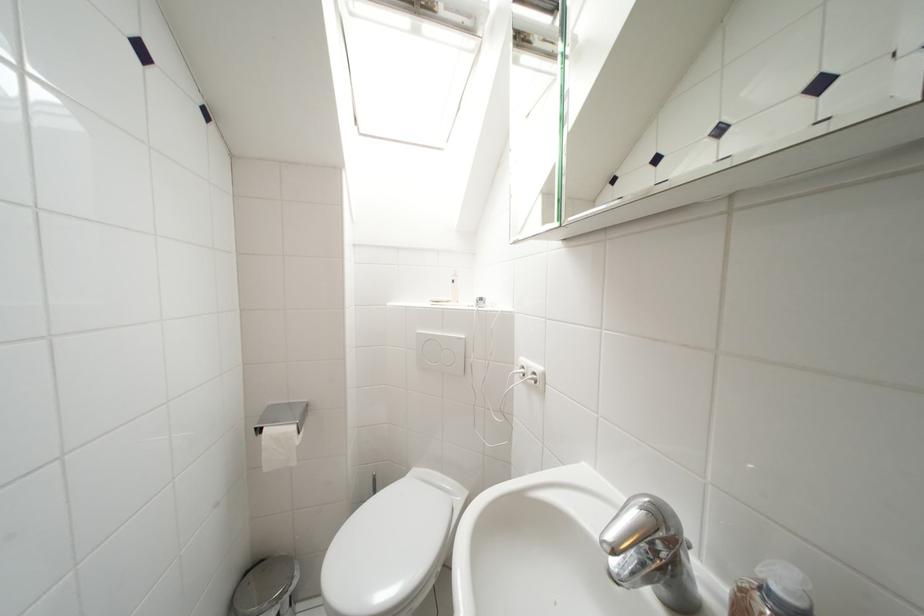
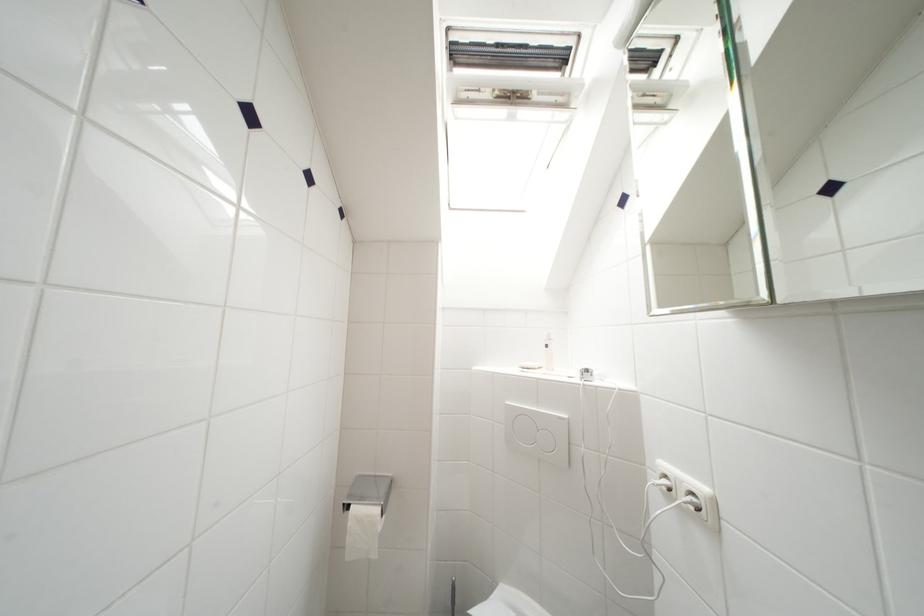
Where in the second image is the point corresponding to (541,377) from the first image?

(699, 498)